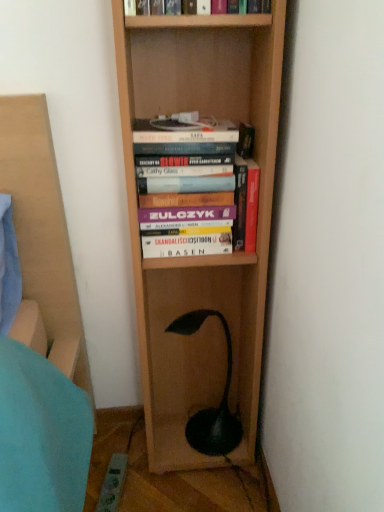
Image resolution: width=384 pixels, height=512 pixels. In order to click on vacant space underneath hardcover book at upper center, the 3th book from the bottom (from a real-world perspective) in this screenshot , I will do `click(175, 124)`.